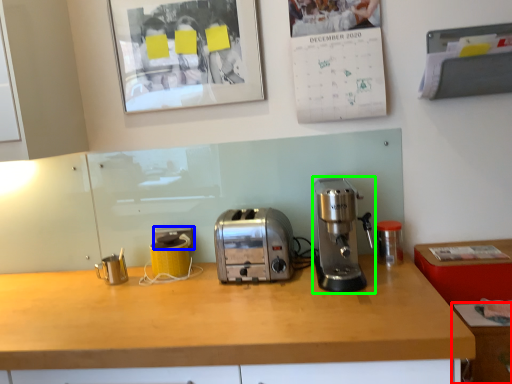
Question: Based on their relative distances, which object is nearer to cabinetry (highlighted by a red box)? Choose from electric outlet (highlighted by a blue box) and coffee maker (highlighted by a green box).

Choices:
 (A) electric outlet
 (B) coffee maker

Answer: (B)